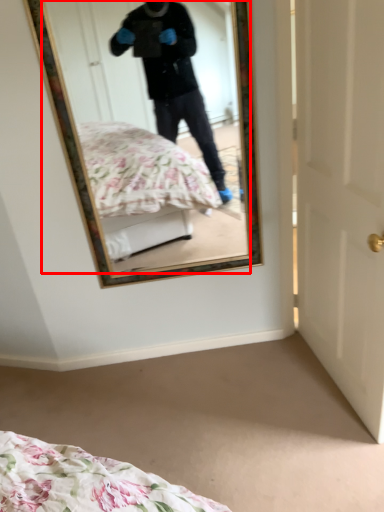
Question: Considering the relative positions of mirror (annotated by the red box) and door in the image provided, where is mirror (annotated by the red box) located with respect to the staircase?

Choices:
 (A) right
 (B) left

Answer: (B)